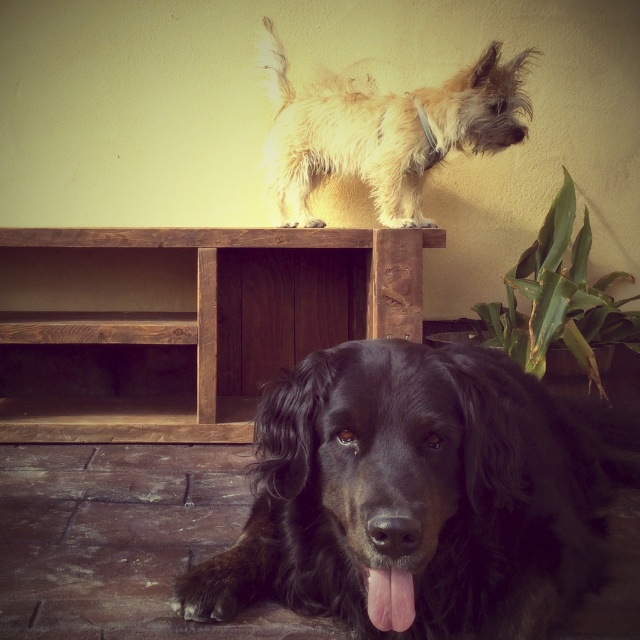
You are a dog trainer assessing the space requirements for two dogs in a home. You see the black fur dog at lower center and the fuzzy beige dog at upper center. Based on their sizes, which dog would require a larger living area?

The black fur dog at lower center requires a larger living area because its width is greater than the fuzzy beige dog at upper center.

You are a photographer setting up a shoot in this room. You want to position a light source to the left of the black fur dog at lower center and to the right of the fuzzy beige dog at upper center. Is this possible given their positions?

The black fur dog at lower center is to the right of the fuzzy beige dog at upper center, so placing a light source to the left of the black fur dog at lower center and to the right of the fuzzy beige dog at upper center is possible as their positions allow for such placement between them.